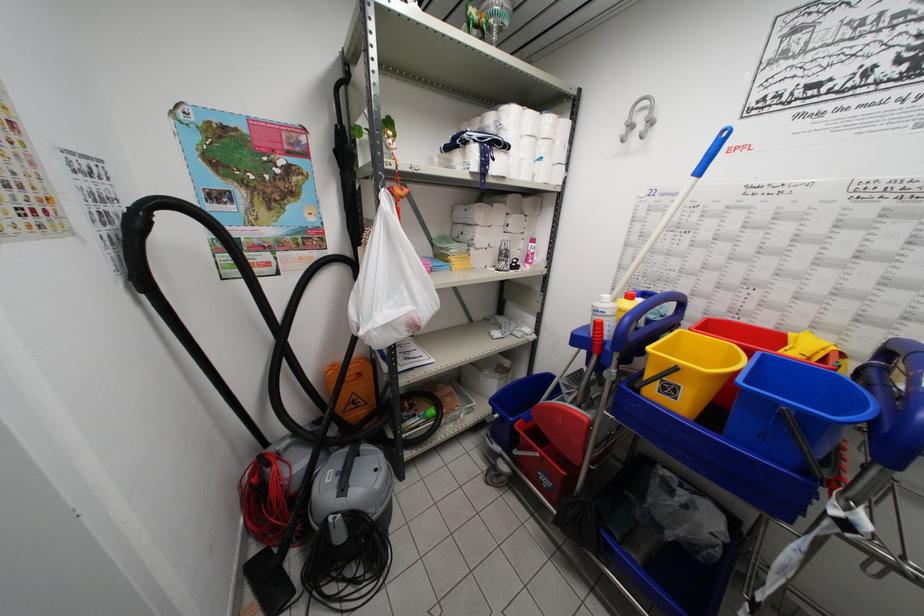
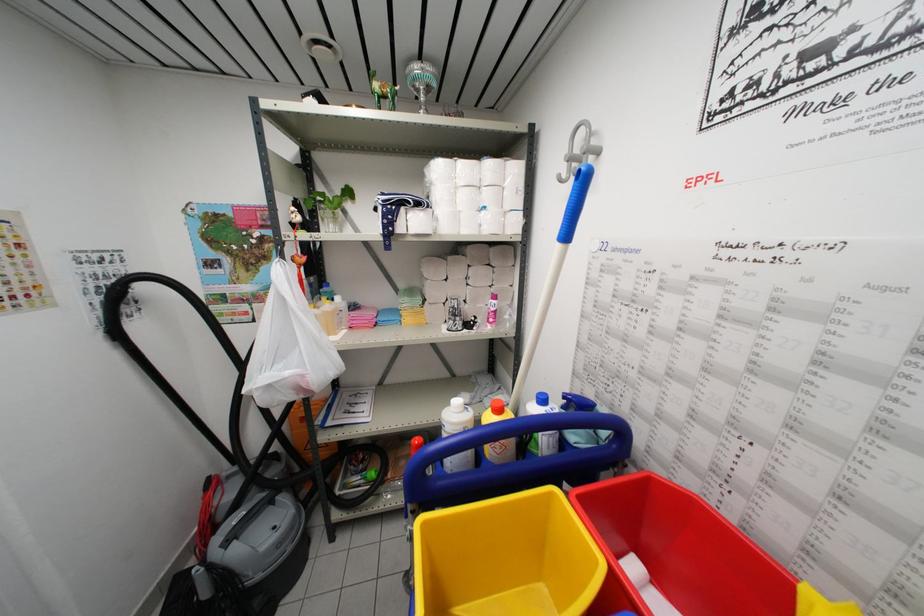
Find the pixel in the second image that matches (x=497, y=209) in the first image.

(453, 262)